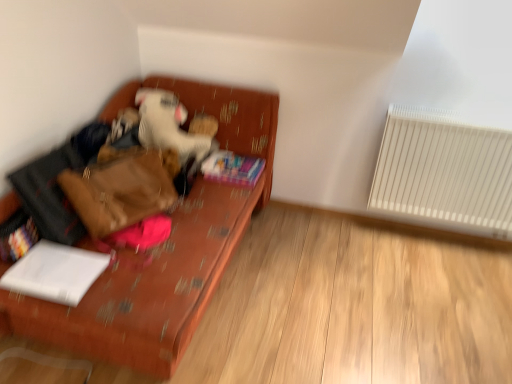
Question: Considering the relative sizes of multicolored plastic book at lower left, the first book viewed from the left, and multicolored paper book at center, which ranks as the third book in front-to-back order, in the image provided, is multicolored plastic book at lower left, the first book viewed from the left, bigger than multicolored paper book at center, which ranks as the third book in front-to-back order,?

Choices:
 (A) no
 (B) yes

Answer: (A)

Question: Can you confirm if multicolored plastic book at lower left, the first book viewed from the left, is positioned to the right of multicolored paper book at center, arranged as the 1th book when viewed from the right?

Choices:
 (A) no
 (B) yes

Answer: (A)

Question: Can you confirm if multicolored plastic book at lower left, which is counted as the second book, starting from the top, is positioned to the left of multicolored paper book at center, arranged as the 1th book when viewed from the right?

Choices:
 (A) yes
 (B) no

Answer: (A)

Question: Does multicolored plastic book at lower left, which ranks as the second book in front-to-back order, lie behind multicolored paper book at center, which appears as the third book when viewed from the left?

Choices:
 (A) no
 (B) yes

Answer: (A)

Question: Can multicolored paper book at center, the 3th book from the bottom, be found inside multicolored plastic book at lower left, positioned as the second book in back-to-front order?

Choices:
 (A) no
 (B) yes

Answer: (A)

Question: Considering the relative sizes of multicolored plastic book at lower left, which is the 3th book from right to left, and multicolored paper book at center, arranged as the 1th book when viewed from the right, in the image provided, is multicolored plastic book at lower left, which is the 3th book from right to left, smaller than multicolored paper book at center, arranged as the 1th book when viewed from the right,?

Choices:
 (A) yes
 (B) no

Answer: (A)

Question: From the image's perspective, is multicolored plastic book at lower left, which is the 3th book from right to left, over textured orange couch at left?

Choices:
 (A) no
 (B) yes

Answer: (A)

Question: Does multicolored plastic book at lower left, positioned as the second book in back-to-front order, come in front of textured orange couch at left?

Choices:
 (A) yes
 (B) no

Answer: (B)

Question: Considering the relative sizes of multicolored plastic book at lower left, which ranks as the second book in front-to-back order, and textured orange couch at left in the image provided, is multicolored plastic book at lower left, which ranks as the second book in front-to-back order, thinner than textured orange couch at left?

Choices:
 (A) no
 (B) yes

Answer: (B)

Question: Does multicolored plastic book at lower left, which is the 3th book from right to left, have a greater width compared to textured orange couch at left?

Choices:
 (A) yes
 (B) no

Answer: (B)

Question: Does multicolored plastic book at lower left, which ranks as the second book in front-to-back order, appear on the right side of textured orange couch at left?

Choices:
 (A) yes
 (B) no

Answer: (B)

Question: Is multicolored plastic book at lower left, which is counted as the second book, starting from the top, further to camera compared to textured orange couch at left?

Choices:
 (A) no
 (B) yes

Answer: (B)

Question: Can you confirm if white plastic radiator at right is positioned to the right of multicolored plastic book at lower left, which ranks as the second book in front-to-back order?

Choices:
 (A) yes
 (B) no

Answer: (A)